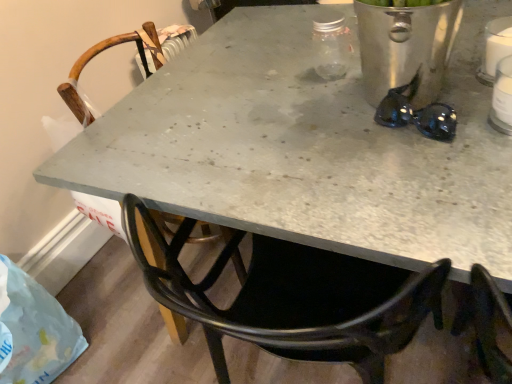
Locate an element on the screen. The width and height of the screenshot is (512, 384). free space to the back side of white plastic bottle at upper right is located at coordinates (462, 81).